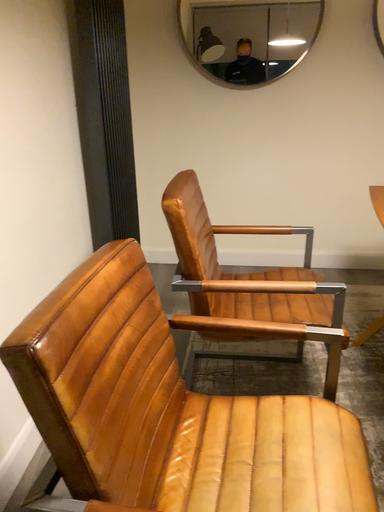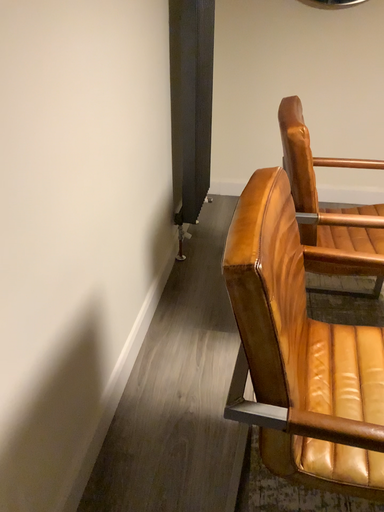
Question: How did the camera likely rotate when shooting the video?

Choices:
 (A) rotated downward
 (B) rotated upward

Answer: (A)